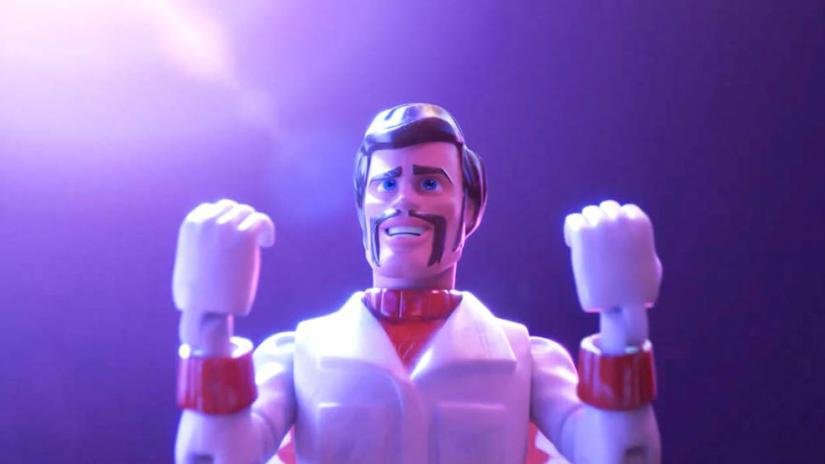
Where is `toy`? This screenshot has width=825, height=464. toy is located at coordinates (404, 204).